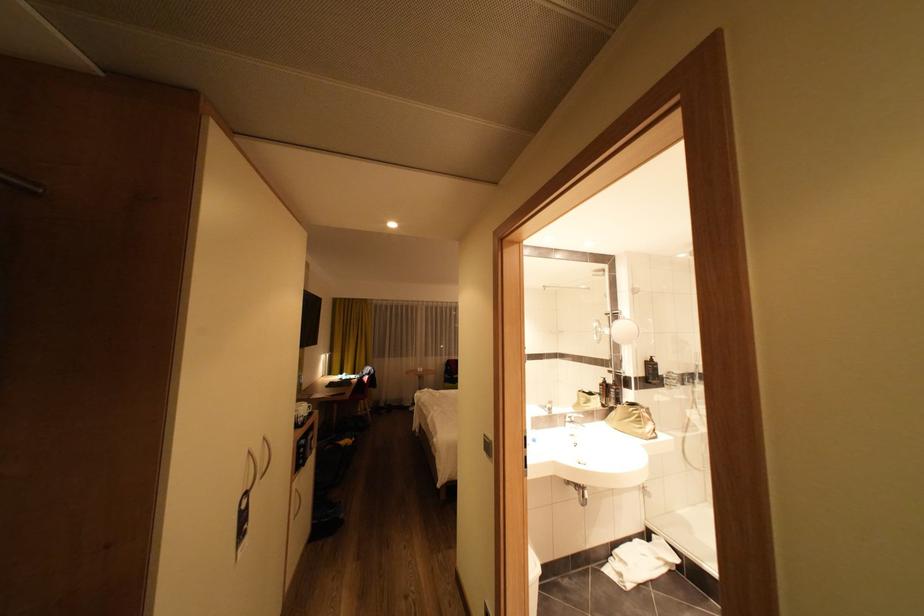
Describe the element at coordinates (300, 410) in the screenshot. Image resolution: width=924 pixels, height=616 pixels. I see `a white mug` at that location.